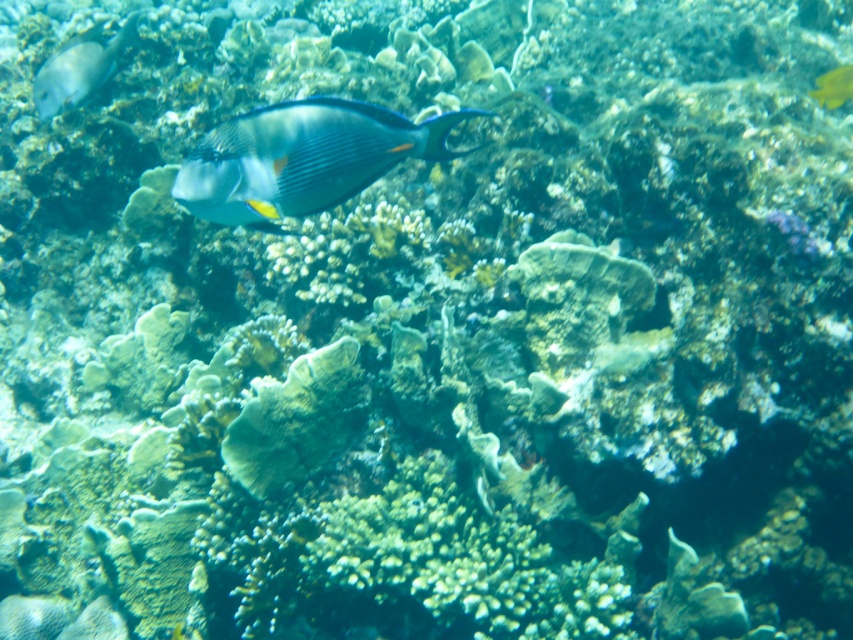
Is the position of blue glossy fish at center more distant than that of shiny silver fish at upper left?

No, it is not.

Is point (263, 120) in front of point (105, 60)?

Yes, it is in front of point (105, 60).

Locate an element on the screen. blue glossy fish at center is located at coordinates (302, 157).

Does blue glossy fish at center appear under yellow matte fish at upper right?

Correct, blue glossy fish at center is located below yellow matte fish at upper right.

Does blue glossy fish at center come behind yellow matte fish at upper right?

No, it is not.

The image size is (853, 640). What do you see at coordinates (302, 157) in the screenshot? I see `blue glossy fish at center` at bounding box center [302, 157].

Image resolution: width=853 pixels, height=640 pixels. I want to click on blue glossy fish at center, so (x=302, y=157).

Is point (53, 61) farther from viewer compared to point (845, 72)?

Yes, point (53, 61) is farther from viewer.

Is shiny silver fish at upper left positioned before yellow matte fish at upper right?

No, it is not.

Is point (33, 99) farther from viewer compared to point (840, 67)?

No, it is in front of (840, 67).

Locate an element on the screen. shiny silver fish at upper left is located at coordinates (79, 68).